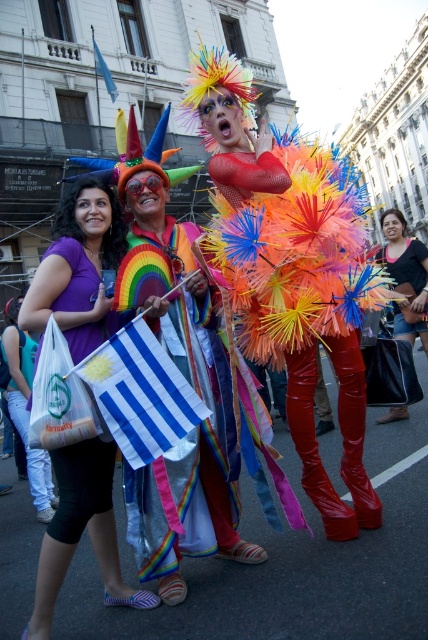
You are a parade participant holding a 2.5 meter long pole. You need to place your pole between the rainbow fabric flag at center and the blue fabric flag at upper left. Is there enough space to do so without the pole touching either flag?

The distance between the rainbow fabric flag at center and the blue fabric flag at upper left is 39.90 meters. Since the pole is only 2.5 meters long, there is ample space to place it between them without touching either flag.

You are a photographer trying to capture a photo of the festive scene. You want to ensure that both the glossy red boots at center and the purple fabric bag at center are visible in the frame. Based on their positions, which object should you position closer to the left side of your camera viewfinder to include both?

Since the glossy red boots at center are to the right of the purple fabric bag at center, you should position the purple fabric bag at center closer to the left side of your camera viewfinder to ensure both objects are visible in the frame.